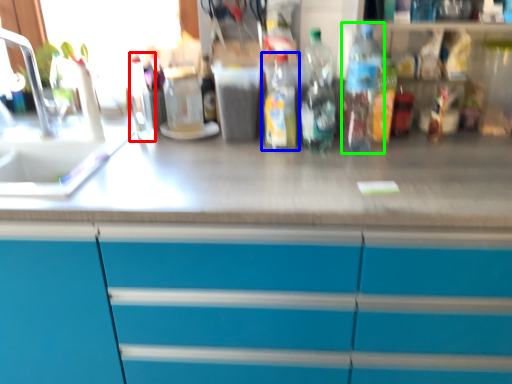
Question: Considering the real-world distances, which object is farthest from bottle (highlighted by a red box)? bottle (highlighted by a blue box) or bottle (highlighted by a green box)?

Choices:
 (A) bottle
 (B) bottle

Answer: (B)